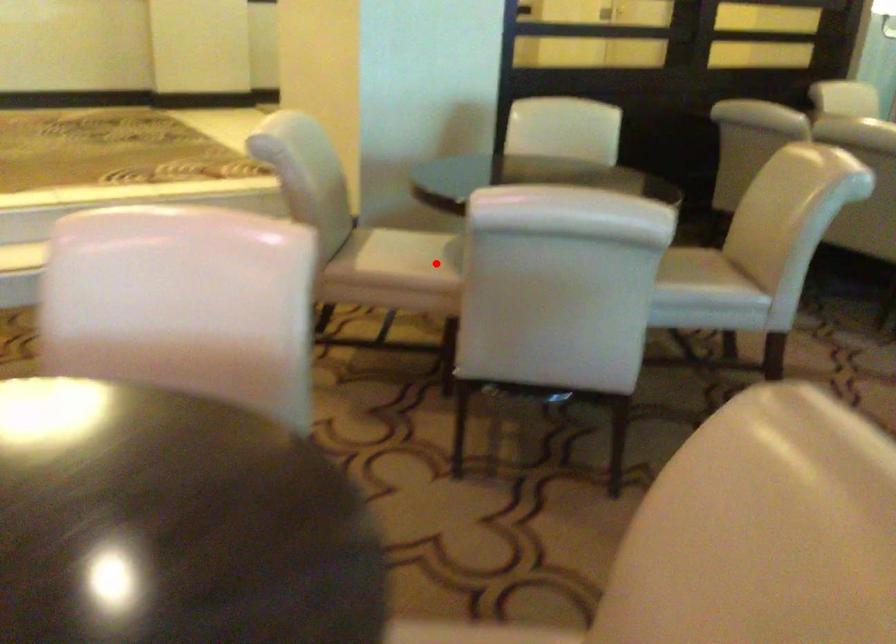
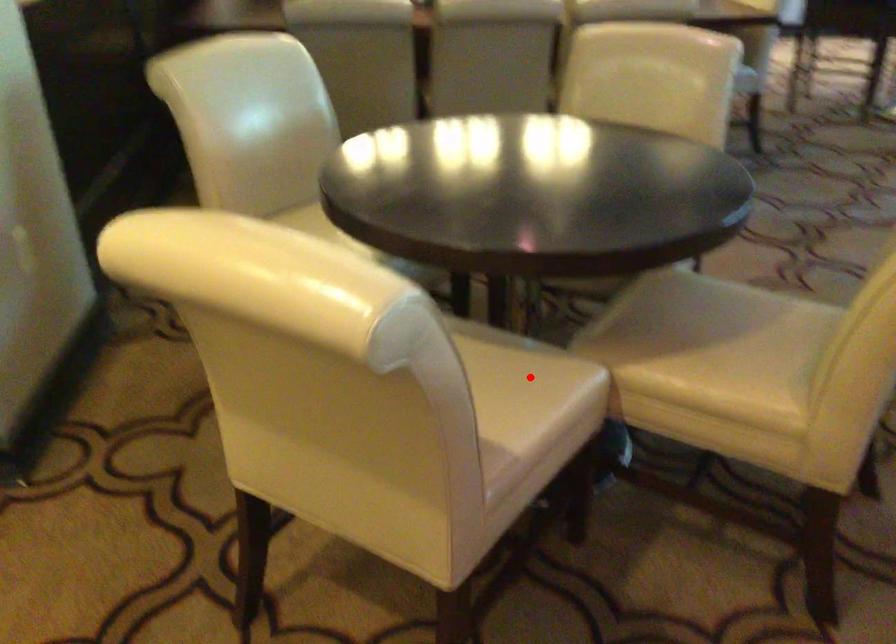
I am providing you with two images of the same scene from different viewpoints. A red point is marked on the first image and another point is marked on the second image. Is the marked point in image1 the same physical position as the marked point in image2?

Yes